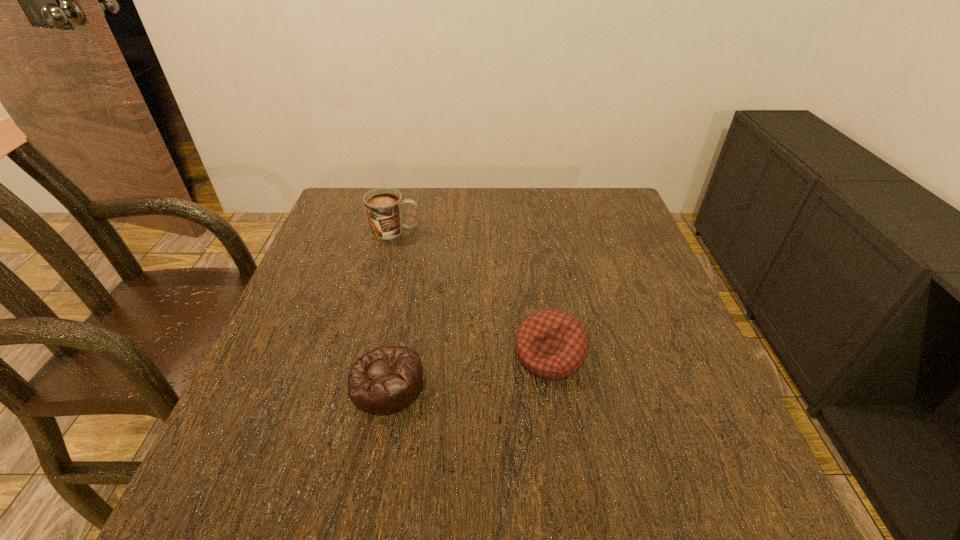
Find the location of a particular element. Image resolution: width=960 pixels, height=540 pixels. the farthest object is located at coordinates (384, 206).

Image resolution: width=960 pixels, height=540 pixels. Identify the location of mug. (384, 206).

Identify the location of the rightmost object. This screenshot has height=540, width=960. (552, 344).

The height and width of the screenshot is (540, 960). Identify the location of the taller beanbag. (552, 344).

In order to click on the shortest object in this screenshot , I will do click(x=386, y=380).

Where is `the shorter beanbag`? the shorter beanbag is located at coordinates (386, 380).

Where is `vacant space situated 0.050m on the side of the farthest object with the handle`? This screenshot has height=540, width=960. vacant space situated 0.050m on the side of the farthest object with the handle is located at coordinates (440, 231).

Locate an element on the screen. The image size is (960, 540). vacant space situated on the left of the right beanbag is located at coordinates (378, 355).

Identify the location of vacant space situated 0.230m on the right of the left beanbag. This screenshot has height=540, width=960. (546, 384).

This screenshot has height=540, width=960. Find the location of `object positioned at the far edge`. object positioned at the far edge is located at coordinates (384, 206).